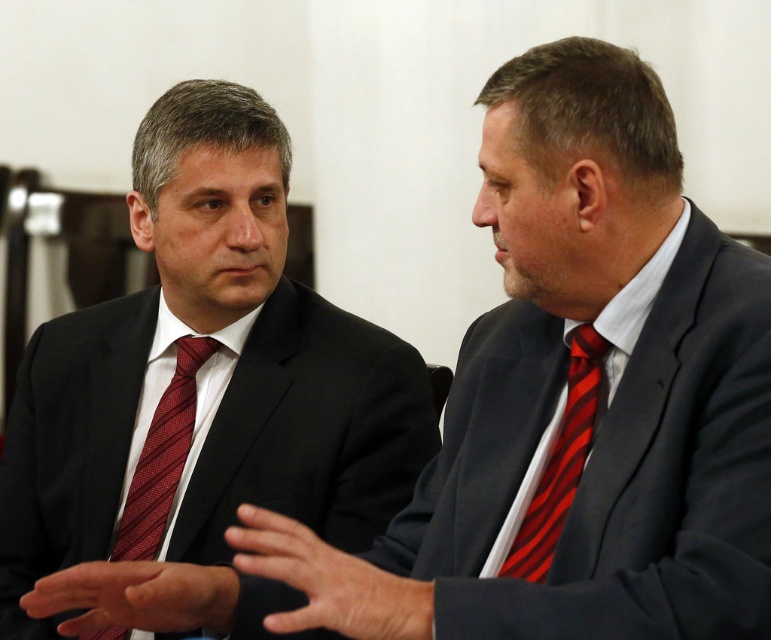
Question: Which is nearer to the matte black suit at center?

Choices:
 (A) matte black suit at left
 (B) red striped tie at left

Answer: (B)

Question: Which of these objects is positioned closest to the red striped tie at left?

Choices:
 (A) red striped tie at right
 (B) matte black suit at center
 (C) matte black suit at left

Answer: (B)

Question: Estimate the real-world distances between objects in this image. Which object is closer to the matte black suit at left?

Choices:
 (A) red striped tie at left
 (B) matte black suit at center

Answer: (B)

Question: Is red striped tie at left wider than red striped tie at right?

Choices:
 (A) no
 (B) yes

Answer: (B)

Question: Is matte black suit at center below red striped tie at right?

Choices:
 (A) no
 (B) yes

Answer: (A)

Question: Is the position of matte black suit at center more distant than that of red striped tie at right?

Choices:
 (A) yes
 (B) no

Answer: (B)